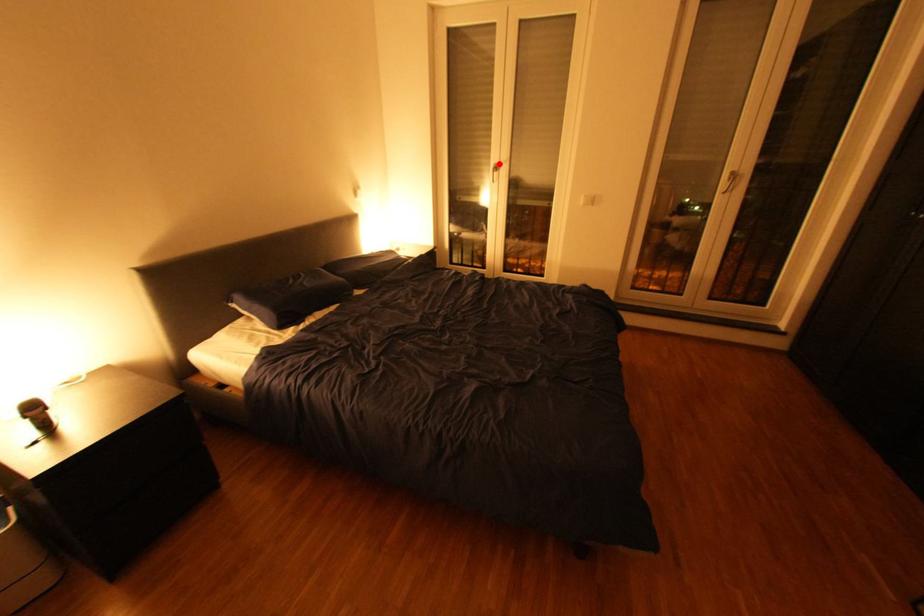
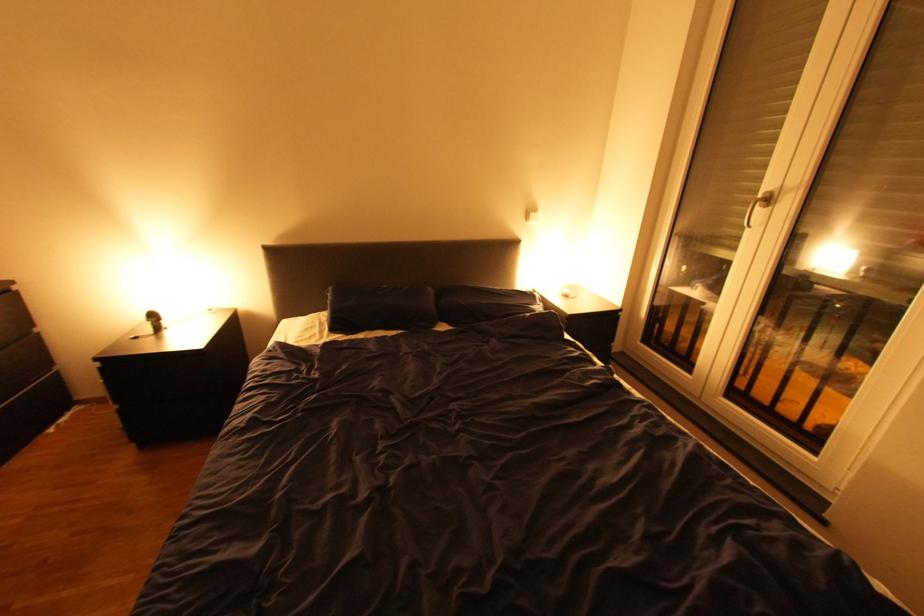
Question: I am providing you with two images of the same scene from different viewpoints. A red point is shown in image1. For the corresponding object point in image2, is it positioned nearer or farther from the camera?

Choices:
 (A) Nearer
 (B) Farther

Answer: (B)